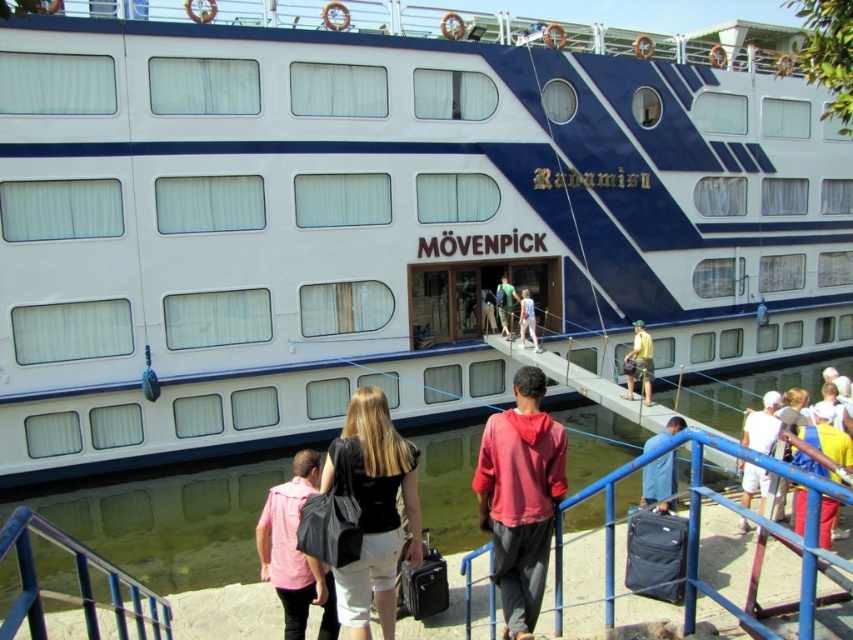
Question: Is clear water at lower center smaller than red matte hoodie at center?

Choices:
 (A) no
 (B) yes

Answer: (A)

Question: Is red matte hoodie at center thinner than yellow fabric shirt at center?

Choices:
 (A) yes
 (B) no

Answer: (A)

Question: Which object is positioned farthest from the light blue denim jeans at center?

Choices:
 (A) clear water at lower center
 (B) red matte hoodie at center
 (C) black fabric bag at center

Answer: (B)

Question: Can you confirm if clear water at lower center is thinner than pink fabric shirt at center?

Choices:
 (A) no
 (B) yes

Answer: (A)

Question: Which is nearer to the red matte hoodie at center?

Choices:
 (A) light blue denim jeans at center
 (B) black fabric bag at center
 (C) pink fabric shirt at center
 (D) yellow fabric shirt at lower right

Answer: (B)

Question: Among these objects, which one is nearest to the camera?

Choices:
 (A) pink fabric shirt at center
 (B) black fabric bag at center
 (C) yellow fabric shirt at lower right
 (D) red matte hoodie at center

Answer: (B)